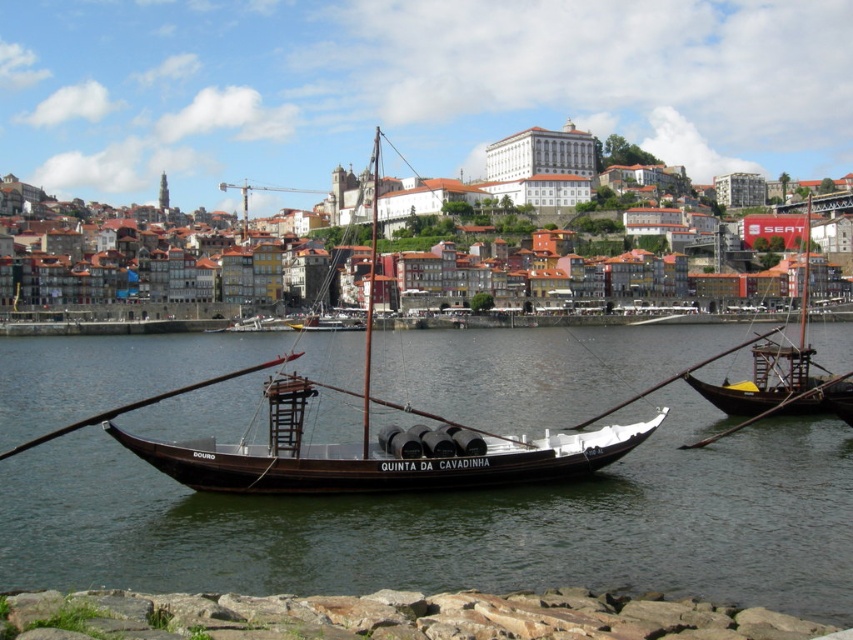
Question: Is wooden sailboat at center below wooden sailboat at right?

Choices:
 (A) yes
 (B) no

Answer: (B)

Question: Estimate the real-world distances between objects in this image. Which object is farther from the brown wooden water at center?

Choices:
 (A) wooden sailboat at center
 (B) wooden sailboat at right

Answer: (B)

Question: Based on their relative distances, which object is farther from the wooden sailboat at center?

Choices:
 (A) wooden sailboat at right
 (B) brown wooden water at center

Answer: (A)

Question: Which point appears farthest from the camera in this image?

Choices:
 (A) (268, 436)
 (B) (759, 376)
 (C) (509, 420)

Answer: (B)

Question: Does brown wooden water at center have a greater width compared to wooden sailboat at right?

Choices:
 (A) yes
 (B) no

Answer: (A)

Question: Is the position of brown wooden water at center more distant than that of wooden sailboat at center?

Choices:
 (A) yes
 (B) no

Answer: (B)